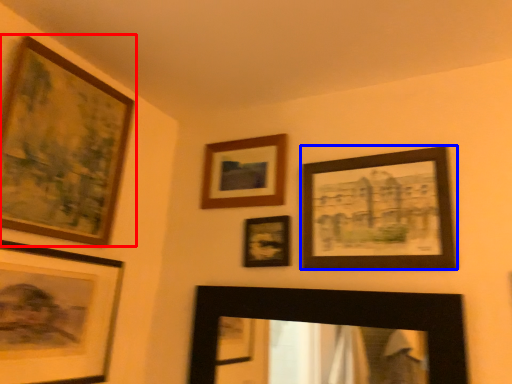
Question: Which of the following is the closest to the observer, picture frame (highlighted by a red box) or picture frame (highlighted by a blue box)?

Choices:
 (A) picture frame
 (B) picture frame

Answer: (A)